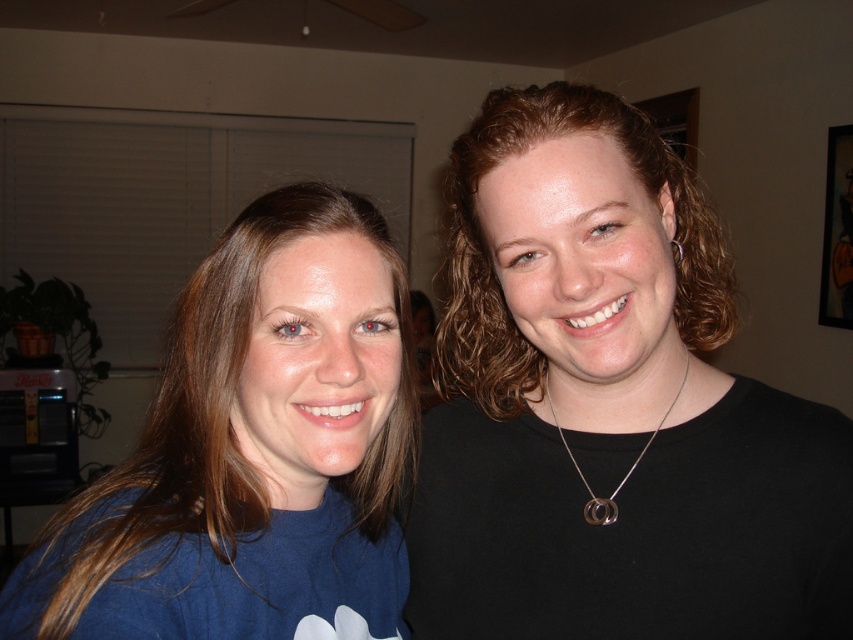
Question: Based on their relative distances, which object is farther from the silver/metallic necklace at center?

Choices:
 (A) black matte shirt at right
 (B) blue matte shirt at left

Answer: (B)

Question: Does black matte shirt at right have a smaller size compared to silver metallic earring at upper right?

Choices:
 (A) yes
 (B) no

Answer: (B)

Question: Which object is closer to the camera taking this photo?

Choices:
 (A) silver/metallic necklace at center
 (B) black matte shirt at right
 (C) blue matte shirt at left

Answer: (C)

Question: Does blue matte shirt at left appear over silver metallic earring at upper right?

Choices:
 (A) no
 (B) yes

Answer: (A)

Question: Is the position of black matte shirt at right less distant than that of blue matte shirt at left?

Choices:
 (A) no
 (B) yes

Answer: (A)

Question: Which of the following is the closest to the observer?

Choices:
 (A) silver metallic earring at upper right
 (B) silver/metallic necklace at center

Answer: (B)